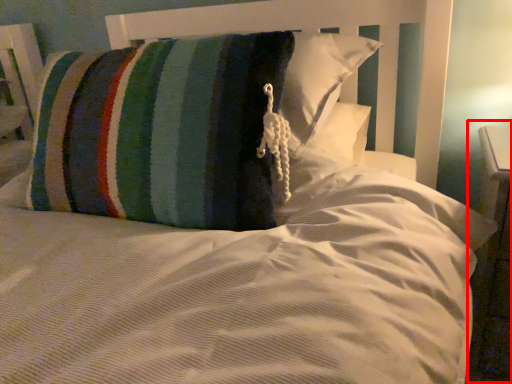
Question: From the image's perspective, what is the correct spatial relationship of dresser (annotated by the red box) in relation to pillow?

Choices:
 (A) above
 (B) below

Answer: (B)